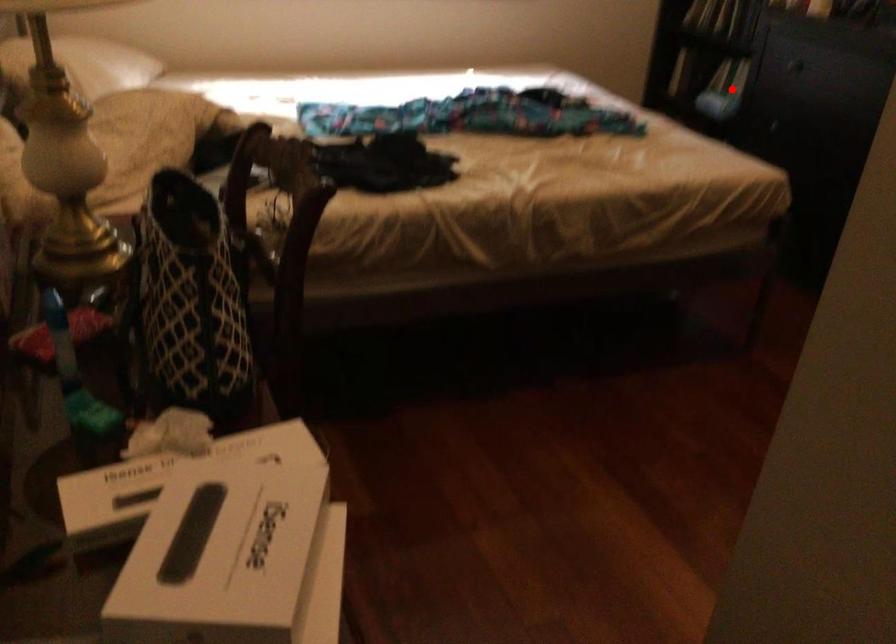
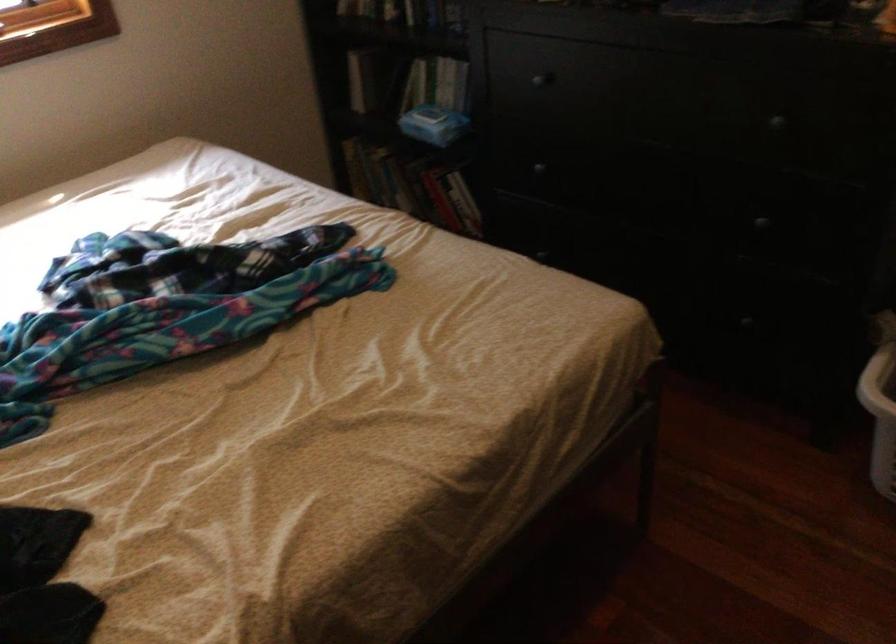
Where in the second image is the point corresponding to the highlighted location from the first image?

(433, 124)